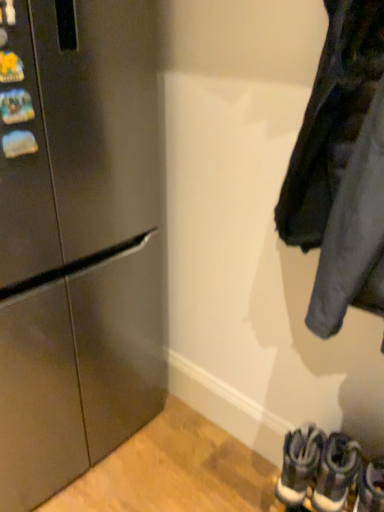
Question: Is dark gray suede sneakers at lower right, which is counted as the second footwear, starting from the left, shorter than dark gray fabric jacket at right?

Choices:
 (A) yes
 (B) no

Answer: (A)

Question: Is dark gray suede sneakers at lower right, the 2th footwear from the right, bigger than dark gray fabric jacket at right?

Choices:
 (A) yes
 (B) no

Answer: (B)

Question: Is dark gray suede sneakers at lower right, which is counted as the second footwear, starting from the left, smaller than dark gray fabric jacket at right?

Choices:
 (A) yes
 (B) no

Answer: (A)

Question: Does dark gray suede sneakers at lower right, which is counted as the second footwear, starting from the left, contain dark gray fabric jacket at right?

Choices:
 (A) no
 (B) yes

Answer: (A)

Question: Does dark gray suede sneakers at lower right, the 2th footwear from the right, turn towards dark gray fabric jacket at right?

Choices:
 (A) no
 (B) yes

Answer: (A)

Question: Does white leather sneakers at lower right, positioned as the 3th footwear in right-to-left order, appear on the right side of white leather sneakers at lower right, arranged as the 3th footwear when viewed from the left?

Choices:
 (A) yes
 (B) no

Answer: (B)

Question: From a real-world perspective, is white leather sneakers at lower right, the first footwear positioned from the left, over white leather sneakers at lower right, arranged as the 3th footwear when viewed from the left?

Choices:
 (A) no
 (B) yes

Answer: (A)

Question: Can you confirm if white leather sneakers at lower right, positioned as the 3th footwear in right-to-left order, is bigger than white leather sneakers at lower right, the first footwear in the right-to-left sequence?

Choices:
 (A) yes
 (B) no

Answer: (A)

Question: Is white leather sneakers at lower right, positioned as the 3th footwear in right-to-left order, shorter than white leather sneakers at lower right, arranged as the 3th footwear when viewed from the left?

Choices:
 (A) no
 (B) yes

Answer: (A)

Question: Is white leather sneakers at lower right, the first footwear positioned from the left, wider than white leather sneakers at lower right, the first footwear in the right-to-left sequence?

Choices:
 (A) no
 (B) yes

Answer: (A)

Question: Is white leather sneakers at lower right, positioned as the 3th footwear in right-to-left order, facing towards white leather sneakers at lower right, arranged as the 3th footwear when viewed from the left?

Choices:
 (A) no
 (B) yes

Answer: (A)

Question: Is white leather sneakers at lower right, arranged as the 3th footwear when viewed from the left, at the right side of stainless steel refrigerator at left?

Choices:
 (A) no
 (B) yes

Answer: (B)